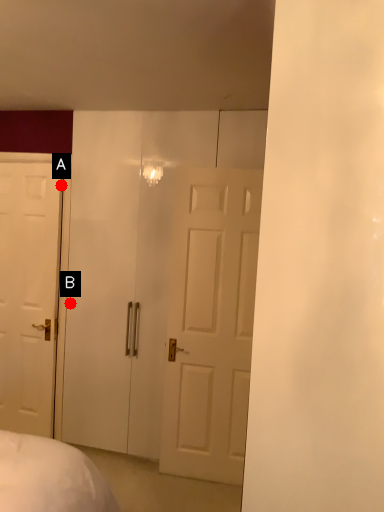
Question: Two points are circled on the image, labeled by A and B beside each circle. Which point is closer to the camera?

Choices:
 (A) A is closer
 (B) B is closer

Answer: (A)